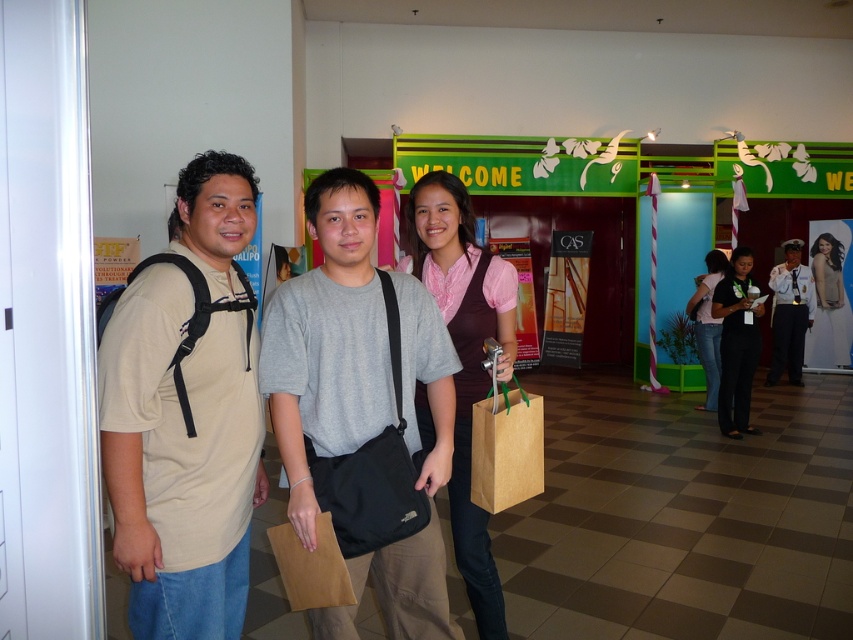
Question: Which point is closer to the camera taking this photo?

Choices:
 (A) (154, 586)
 (B) (798, 266)
 (C) (828, 264)

Answer: (A)

Question: Which point is farther to the camera?

Choices:
 (A) pink fabric shirt at center
 (B) matte gray shirt at center
 (C) beige fabric shirt at left

Answer: (A)

Question: Which point appears closest to the camera in this image?

Choices:
 (A) (302, 490)
 (B) (728, 298)
 (C) (242, 388)
 (D) (482, 352)

Answer: (A)

Question: Does gray fabric bag at center appear over dark gray uniform at right?

Choices:
 (A) no
 (B) yes

Answer: (A)

Question: Is the position of gray fabric bag at center more distant than that of dark gray uniform at right?

Choices:
 (A) yes
 (B) no

Answer: (B)

Question: Does beige fabric shirt at left have a greater width compared to light beige fabric dress at center?

Choices:
 (A) no
 (B) yes

Answer: (A)